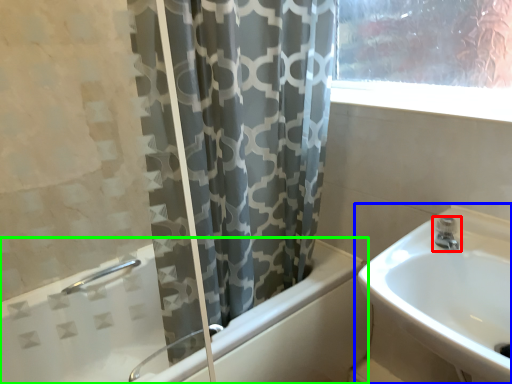
Question: Based on their relative distances, which object is farther from tap (highlighted by a red box)? Choose from sink (highlighted by a blue box) and bathtub (highlighted by a green box).

Choices:
 (A) sink
 (B) bathtub

Answer: (B)